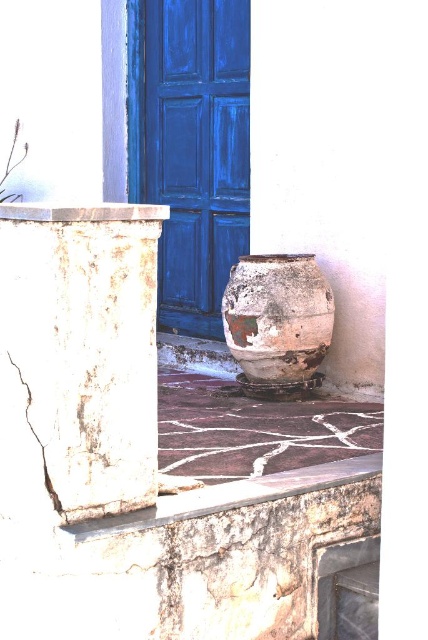
Which of these two, white cracked stone column at left or rusty ceramic vase at center, stands taller?

Standing taller between the two is white cracked stone column at left.

Where is `white cracked stone column at left`? This screenshot has width=428, height=640. white cracked stone column at left is located at coordinates (86, 346).

Locate an element on the screen. Image resolution: width=428 pixels, height=640 pixels. white cracked stone column at left is located at coordinates (x=86, y=346).

Is point (107, 444) positioned in front of point (133, 92)?

That is True.

Is white cracked stone column at left shorter than blue painted wood door at center?

Yes, white cracked stone column at left is shorter than blue painted wood door at center.

Which is behind, point (61, 490) or point (214, 140)?

Positioned behind is point (214, 140).

The width and height of the screenshot is (428, 640). Identify the location of white cracked stone column at left. (86, 346).

Between rusty ceramic vase at center and rusty stone ledge at lower center, which one is positioned lower?

rusty stone ledge at lower center is lower down.

Is rusty ceramic vase at center smaller than rusty stone ledge at lower center?

No, rusty ceramic vase at center is not smaller than rusty stone ledge at lower center.

Locate an element on the screen. rusty ceramic vase at center is located at coordinates (278, 323).